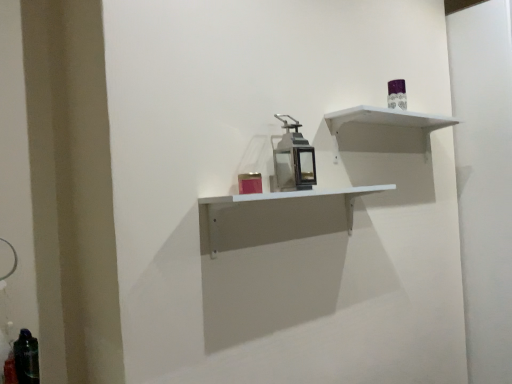
Image resolution: width=512 pixels, height=384 pixels. What do you see at coordinates (281, 199) in the screenshot?
I see `white matte shelf at center, the second shelf viewed from the top` at bounding box center [281, 199].

Describe the element at coordinates (26, 358) in the screenshot. I see `translucent dark green bottle at lower left` at that location.

This screenshot has height=384, width=512. Describe the element at coordinates (387, 122) in the screenshot. I see `white matte shelf at upper right, placed as the first shelf when sorted from top to bottom` at that location.

The width and height of the screenshot is (512, 384). I want to click on white matte shelf at center, the second shelf viewed from the top, so click(281, 199).

How many degrees apart are the facing directions of white matte shelf at upper right, which is the 2th shelf from bottom to top, and translucent dark green bottle at lower left?

0.212 degrees separate the facing orientations of white matte shelf at upper right, which is the 2th shelf from bottom to top, and translucent dark green bottle at lower left.

Is white matte shelf at upper right, which is the 2th shelf from bottom to top, oriented towards translucent dark green bottle at lower left?

No, white matte shelf at upper right, which is the 2th shelf from bottom to top, is not aimed at translucent dark green bottle at lower left.

Considering the relative sizes of white matte shelf at upper right, which is the 2th shelf from bottom to top, and translucent dark green bottle at lower left in the image provided, is white matte shelf at upper right, which is the 2th shelf from bottom to top, wider than translucent dark green bottle at lower left?

Indeed, white matte shelf at upper right, which is the 2th shelf from bottom to top, has a greater width compared to translucent dark green bottle at lower left.

Are white matte shelf at upper right, placed as the first shelf when sorted from top to bottom, and translucent dark green bottle at lower left beside each other?

No, white matte shelf at upper right, placed as the first shelf when sorted from top to bottom, is not touching translucent dark green bottle at lower left.

Which is closer, (x=210, y=208) or (x=428, y=119)?

The point (x=210, y=208) is in front.

Is white matte shelf at center, the 1th shelf from the bottom, bigger than white matte shelf at upper right, which is the 2th shelf from bottom to top?

Indeed, white matte shelf at center, the 1th shelf from the bottom, has a larger size compared to white matte shelf at upper right, which is the 2th shelf from bottom to top.

From the image's perspective, is white matte shelf at center, the 1th shelf from the bottom, on top of white matte shelf at upper right, which is the 2th shelf from bottom to top?

No, from the image's perspective, white matte shelf at center, the 1th shelf from the bottom, is not above white matte shelf at upper right, which is the 2th shelf from bottom to top.

Is white matte shelf at center, the 1th shelf from the bottom, spatially inside white matte shelf at upper right, placed as the first shelf when sorted from top to bottom, or outside of it?

white matte shelf at center, the 1th shelf from the bottom, is outside white matte shelf at upper right, placed as the first shelf when sorted from top to bottom.

Is white matte shelf at center, the second shelf viewed from the top, facing towards metallic lantern at center?

No, white matte shelf at center, the second shelf viewed from the top, is not turned towards metallic lantern at center.

In terms of size, does white matte shelf at center, the second shelf viewed from the top, appear bigger or smaller than metallic lantern at center?

Clearly, white matte shelf at center, the second shelf viewed from the top, is larger in size than metallic lantern at center.

Who is more distant, white matte shelf at center, the 1th shelf from the bottom, or metallic lantern at center?

metallic lantern at center is further away from the camera.

From a real-world perspective, which object stands above the other?

metallic lantern at center is physically above.

The width and height of the screenshot is (512, 384). Find the location of `medicine cabinet on the right of translucent dark green bottle at lower left`. medicine cabinet on the right of translucent dark green bottle at lower left is located at coordinates (293, 159).

Is point (20, 370) positioned in front of point (303, 174)?

Yes, point (20, 370) is in front of point (303, 174).

From the image's perspective, relative to metallic lantern at center, is translucent dark green bottle at lower left above or below?

Clearly, from the image's perspective, translucent dark green bottle at lower left is below metallic lantern at center.

Is translucent dark green bottle at lower left positioned beyond the bounds of metallic lantern at center?

Yes, translucent dark green bottle at lower left is not within metallic lantern at center.

From a real-world perspective, is translucent dark green bottle at lower left below white matte shelf at upper right, which is the 2th shelf from bottom to top?

Yes, from a real-world perspective, translucent dark green bottle at lower left is beneath white matte shelf at upper right, which is the 2th shelf from bottom to top.

Is translucent dark green bottle at lower left wider or thinner than white matte shelf at upper right, which is the 2th shelf from bottom to top?

translucent dark green bottle at lower left is thinner than white matte shelf at upper right, which is the 2th shelf from bottom to top.

From the picture: Which is farther from the camera, (21, 352) or (396, 120)?

The point (396, 120) is behind.

Measure the distance from metallic lantern at center to translucent dark green bottle at lower left.

metallic lantern at center is 3.39 feet from translucent dark green bottle at lower left.

Which of these two, metallic lantern at center or translucent dark green bottle at lower left, stands shorter?

translucent dark green bottle at lower left.

Between metallic lantern at center and translucent dark green bottle at lower left, which one appears on the left side from the viewer's perspective?

translucent dark green bottle at lower left is more to the left.

Which of these two, metallic lantern at center or translucent dark green bottle at lower left, is wider?

Wider between the two is metallic lantern at center.

At what (x,y) coordinates should I click in order to perform the action: click on medicine cabinet below the white matte shelf at upper right, which is the 2th shelf from bottom to top (from the image's perspective). Please return your answer as a coordinate pair (x, y). Looking at the image, I should click on (293, 159).

Which object is positioned more to the left, metallic lantern at center or white matte shelf at upper right, placed as the first shelf when sorted from top to bottom?

From the viewer's perspective, metallic lantern at center appears more on the left side.

Is metallic lantern at center thinner than white matte shelf at upper right, which is the 2th shelf from bottom to top?

Correct, the width of metallic lantern at center is less than that of white matte shelf at upper right, which is the 2th shelf from bottom to top.

Is the depth of metallic lantern at center less than that of white matte shelf at upper right, placed as the first shelf when sorted from top to bottom?

That is True.

Find the location of a particular element. Image resolution: width=512 pixels, height=384 pixels. bottle in front of the white matte shelf at upper right, which is the 2th shelf from bottom to top is located at coordinates (26, 358).

In order to click on shelf on the right of white matte shelf at center, the second shelf viewed from the top in this screenshot , I will do `click(387, 122)`.

Which object lies nearer to the anchor point metallic lantern at center, translucent dark green bottle at lower left or white matte shelf at center, the second shelf viewed from the top?

white matte shelf at center, the second shelf viewed from the top, lies closer to metallic lantern at center than the other object.

Estimate the real-world distances between objects in this image. Which object is further from white matte shelf at center, the 1th shelf from the bottom, white matte shelf at upper right, placed as the first shelf when sorted from top to bottom, or translucent dark green bottle at lower left?

Based on the image, translucent dark green bottle at lower left appears to be further to white matte shelf at center, the 1th shelf from the bottom.

Looking at the image, which one is located further to white matte shelf at upper right, which is the 2th shelf from bottom to top, metallic lantern at center or white matte shelf at center, the second shelf viewed from the top?

Among the two, white matte shelf at center, the second shelf viewed from the top, is located further to white matte shelf at upper right, which is the 2th shelf from bottom to top.

Looking at the image, which one is located closer to white matte shelf at center, the second shelf viewed from the top, translucent dark green bottle at lower left or white matte shelf at upper right, placed as the first shelf when sorted from top to bottom?

Based on the image, white matte shelf at upper right, placed as the first shelf when sorted from top to bottom, appears to be nearer to white matte shelf at center, the second shelf viewed from the top.

Consider the image. From the image, which object appears to be nearer to translucent dark green bottle at lower left, metallic lantern at center or white matte shelf at center, the 1th shelf from the bottom?

white matte shelf at center, the 1th shelf from the bottom, is closer to translucent dark green bottle at lower left.

Based on the photo, considering their positions, is metallic lantern at center positioned closer to translucent dark green bottle at lower left than white matte shelf at upper right, placed as the first shelf when sorted from top to bottom?

metallic lantern at center.

When comparing their distances from white matte shelf at center, the second shelf viewed from the top, does translucent dark green bottle at lower left or metallic lantern at center seem closer?

metallic lantern at center lies closer to white matte shelf at center, the second shelf viewed from the top, than the other object.

From the image, which object appears to be farther from translucent dark green bottle at lower left, white matte shelf at upper right, placed as the first shelf when sorted from top to bottom, or white matte shelf at center, the 1th shelf from the bottom?

white matte shelf at upper right, placed as the first shelf when sorted from top to bottom, is positioned further to the anchor translucent dark green bottle at lower left.

Image resolution: width=512 pixels, height=384 pixels. What are the coordinates of `shelf between metallic lantern at center and white matte shelf at upper right, which is the 2th shelf from bottom to top, from left to right` in the screenshot? It's located at (281, 199).

Locate an element on the screen. This screenshot has height=384, width=512. medicine cabinet located between translucent dark green bottle at lower left and white matte shelf at center, the 1th shelf from the bottom, in the left-right direction is located at coordinates (293, 159).

Find the location of a particular element. This screenshot has height=384, width=512. medicine cabinet located between translucent dark green bottle at lower left and white matte shelf at upper right, which is the 2th shelf from bottom to top, in the left-right direction is located at coordinates (293, 159).

Locate an element on the screen. The width and height of the screenshot is (512, 384). shelf located between translucent dark green bottle at lower left and white matte shelf at upper right, which is the 2th shelf from bottom to top, in the left-right direction is located at coordinates (281, 199).